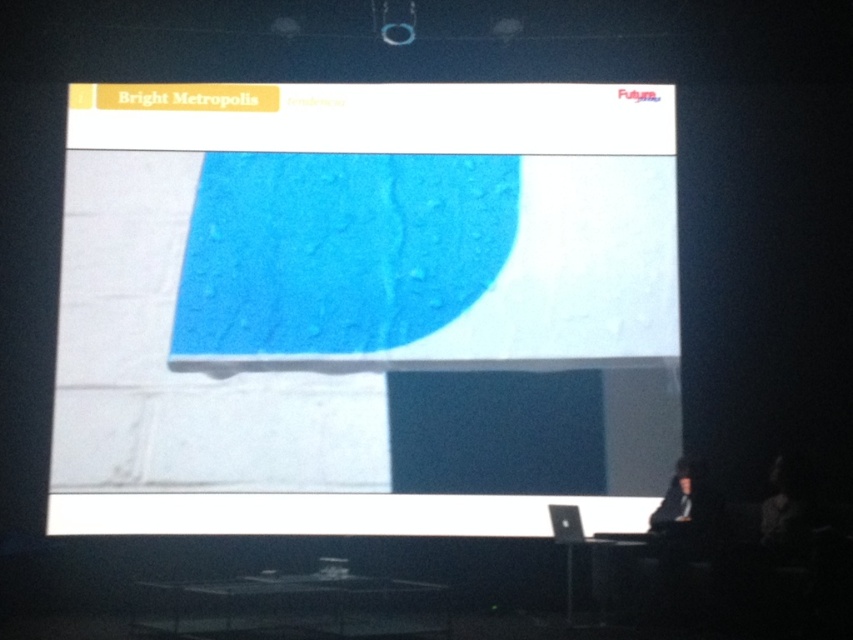
You are an event planner preparing for a conference. You need to ensure that the dark fabric figure at lower right is visible to all attendees. Given that the matte blue fabric at center is larger, what should you consider adjusting to improve visibility?

Since the matte blue fabric at center is bigger than the dark fabric figure at lower right, you should consider reducing the size of the matte blue fabric at center or increasing the size of the dark fabric figure at lower right to ensure the latter is more visible to the audience.

You are an attendee at the conference and you see the slide with the title and logo. There is a point marked at coordinates (x=363, y=305) on the slide. What is located at that point?

The point at coordinates (x=363, y=305) indicates the location of the matte blue fabric at center.

You are an attendee at the conference and you see the slide with the dark fabric figure at lower right and the dark hair at lower right. Which one is more to the left?

The dark fabric figure at lower right is more to the left than the dark hair at lower right.